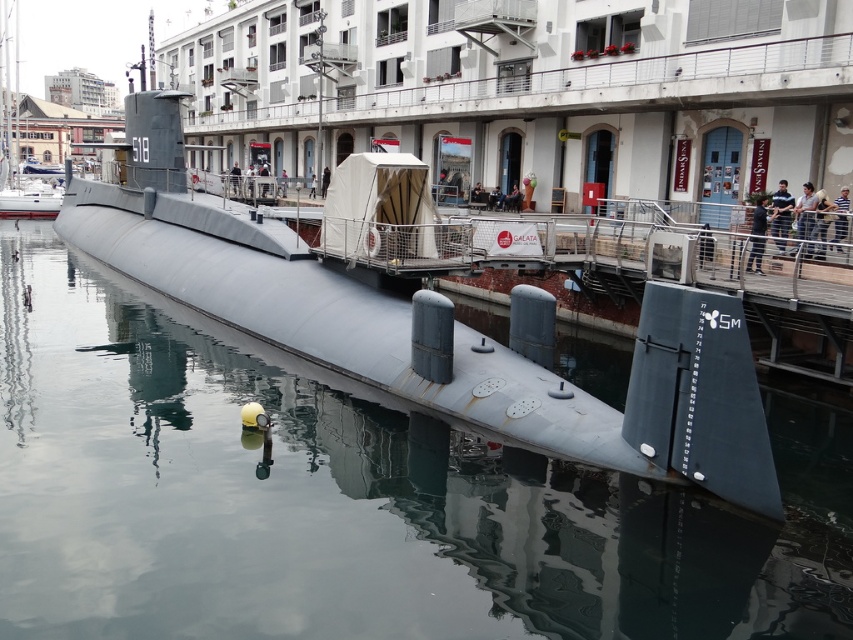
Question: Which point appears farthest from the camera in this image?

Choices:
 (A) (250, 541)
 (B) (581, 397)

Answer: (B)

Question: Does glossy metallic submarine at center have a greater width compared to matte gray submarine at center?

Choices:
 (A) yes
 (B) no

Answer: (B)

Question: Does glossy metallic submarine at center come in front of matte gray submarine at center?

Choices:
 (A) yes
 (B) no

Answer: (A)

Question: Which point is closer to the camera?

Choices:
 (A) (636, 337)
 (B) (454, 540)

Answer: (B)

Question: Where is glossy metallic submarine at center located in relation to matte gray submarine at center in the image?

Choices:
 (A) above
 (B) below

Answer: (B)